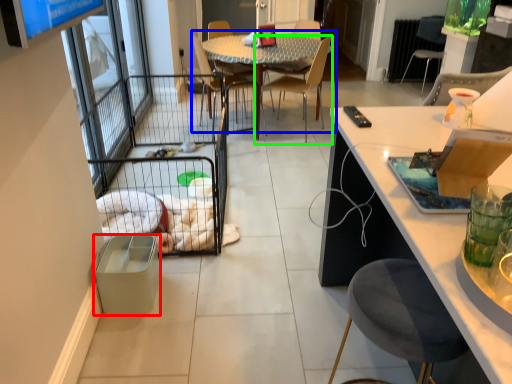
Question: Which object is the closest to the trash bin/can (highlighted by a red box)? Choose among these: kitchen & dining room table (highlighted by a blue box) or chair (highlighted by a green box).

Choices:
 (A) kitchen & dining room table
 (B) chair

Answer: (A)